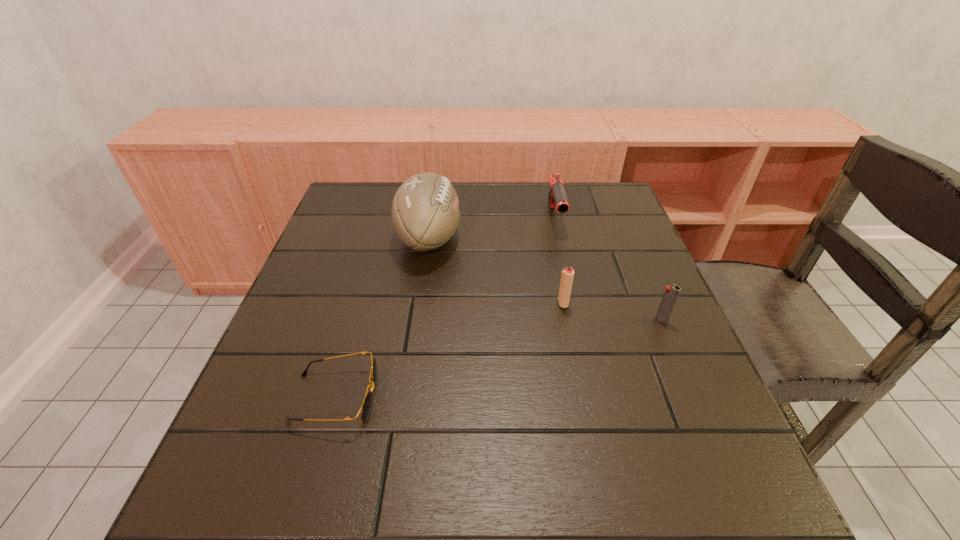
In order to click on empty space between the farther igniter and the nearer igniter in this screenshot , I will do `click(612, 312)`.

You are a GUI agent. You are given a task and a screenshot of the screen. Output one action in this format:
    pyautogui.click(x=<x>, y=<y>)
    Task: Click on the free area in between the nearest object and the right igniter
    This screenshot has width=960, height=540.
    Given the screenshot: What is the action you would take?
    pyautogui.click(x=498, y=359)

Find the location of a particular element. This screenshot has height=540, width=960. vacant space in between the gun and the third farthest object is located at coordinates (559, 261).

Where is `vacant space that is in between the gun and the second nearest object`? vacant space that is in between the gun and the second nearest object is located at coordinates (608, 269).

The image size is (960, 540). What are the coordinates of `vacant area that lies between the shortest object and the right igniter` in the screenshot? It's located at (498, 359).

Identify the location of the fourth closest object to the football (American). (671, 293).

You are a GUI agent. You are given a task and a screenshot of the screen. Output one action in this format:
    pyautogui.click(x=<x>, y=<y>)
    Task: Click on the object that is the fourth closest to the sunglasses
    Image resolution: width=960 pixels, height=540 pixels.
    Given the screenshot: What is the action you would take?
    pyautogui.click(x=671, y=293)

Identify the location of vacant space that satisfies the following two spatial constraints: 1. at the aiming end of the rightmost object; 2. on the right side of the gun. Image resolution: width=960 pixels, height=540 pixels. (578, 320).

The image size is (960, 540). Find the location of `blank space that satisfies the following two spatial constraints: 1. at the aiming end of the gun; 2. on the laces of the football (American)`. blank space that satisfies the following two spatial constraints: 1. at the aiming end of the gun; 2. on the laces of the football (American) is located at coordinates (559, 238).

Identify the location of free spot that satisfies the following two spatial constraints: 1. on the laces of the football (American); 2. on the back side of the rightmost object. Image resolution: width=960 pixels, height=540 pixels. (417, 320).